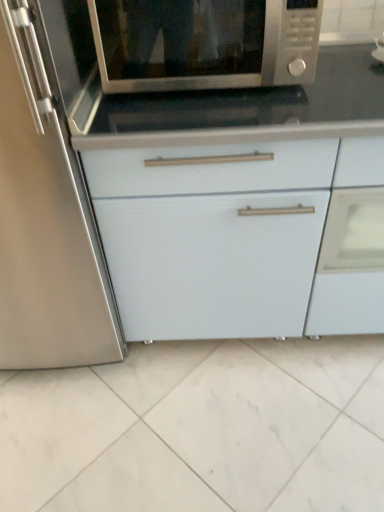
Question: Relative to satin silver microwave at upper center, is white matte cabinet at center in front or behind?

Choices:
 (A) behind
 (B) front

Answer: (A)

Question: Based on their sizes in the image, would you say white matte cabinet at center is bigger or smaller than satin silver microwave at upper center?

Choices:
 (A) big
 (B) small

Answer: (A)

Question: Is point (76, 338) closer or farther from the camera than point (190, 14)?

Choices:
 (A) farther
 (B) closer

Answer: (A)

Question: Visually, is satin silver microwave at upper center positioned to the left or to the right of white matte cabinet at center?

Choices:
 (A) right
 (B) left

Answer: (B)

Question: Is satin silver microwave at upper center wider or thinner than white matte cabinet at center?

Choices:
 (A) thin
 (B) wide

Answer: (A)

Question: From a real-world perspective, is satin silver microwave at upper center physically located above or below white matte cabinet at center?

Choices:
 (A) above
 (B) below

Answer: (A)

Question: Is satin silver microwave at upper center in front of or behind white matte cabinet at center in the image?

Choices:
 (A) behind
 (B) front

Answer: (B)